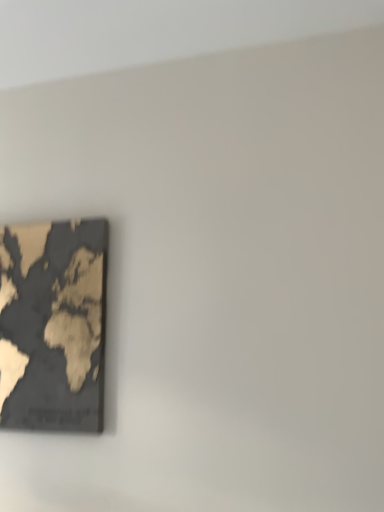
From the picture: What is the approximate width of gold textured map at lower left?

The width of gold textured map at lower left is 1.56 inches.

Identify the location of gold textured map at lower left. (53, 325).

Describe the element at coordinates (53, 325) in the screenshot. This screenshot has width=384, height=512. I see `gold textured map at lower left` at that location.

The image size is (384, 512). What are the coordinates of `gold textured map at lower left` in the screenshot? It's located at (53, 325).